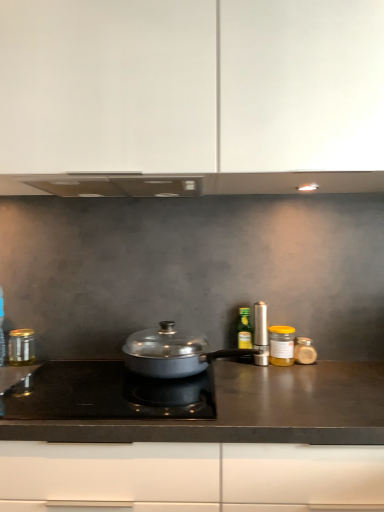
Identify the location of free point above black matte countertop at center (from a real-world perspective). Image resolution: width=384 pixels, height=512 pixels. (198, 382).